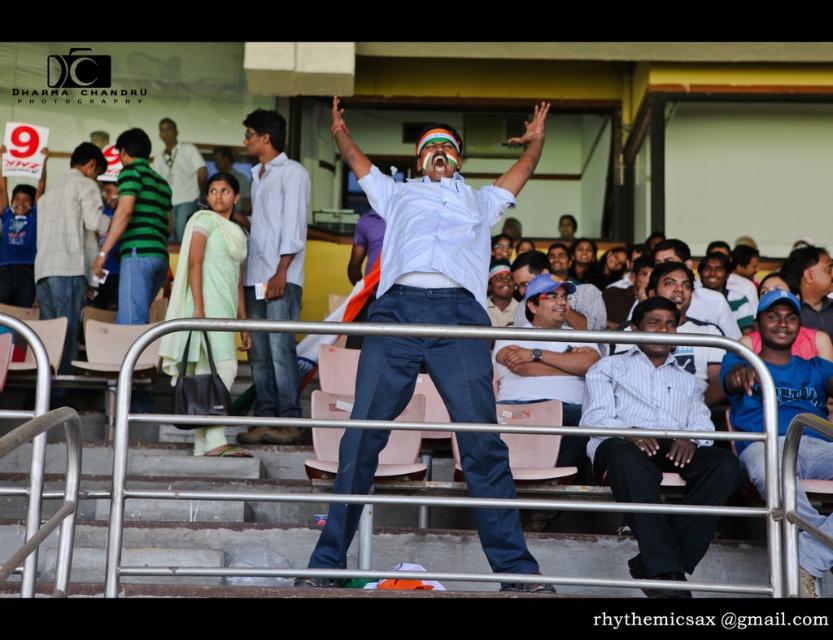
Measure the distance between white cotton shirt at center and matte green shirt at center.

white cotton shirt at center and matte green shirt at center are 18.27 meters apart from each other.

Between white cotton shirt at center and matte green shirt at center, which one is positioned higher?

matte green shirt at center

Find the location of a particular element. white cotton shirt at center is located at coordinates (436, 225).

Identify the location of white cotton shirt at center. (436, 225).

Based on the photo, is blue cotton shirt at center shorter than matte green shirt at center?

Indeed, blue cotton shirt at center has a lesser height compared to matte green shirt at center.

Does point (797, 497) lie in front of point (173, 179)?

Yes, it is.

Between point (811, 588) and point (172, 145), which one is positioned behind?

The point (172, 145) is behind.

Where is `blue cotton shirt at center`? This screenshot has width=833, height=640. blue cotton shirt at center is located at coordinates (791, 358).

Does white striped shirt at center have a greater width compared to light green fabric saree at center?

Indeed, white striped shirt at center has a greater width compared to light green fabric saree at center.

Is white striped shirt at center further to the viewer compared to light green fabric saree at center?

That is False.

Identify the location of white striped shirt at center. (642, 392).